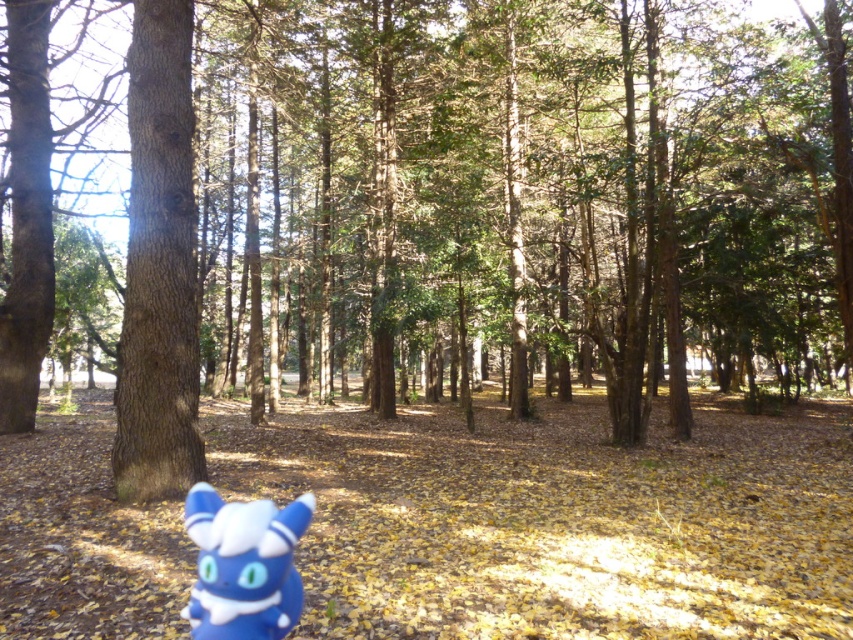
Question: Does smooth brown tree trunk at center appear on the right side of blue plush toy at lower left?

Choices:
 (A) no
 (B) yes

Answer: (A)

Question: Which object appears farthest from the camera in this image?

Choices:
 (A) smooth brown tree trunk at center
 (B) blue plush toy at lower left

Answer: (A)

Question: Can you confirm if smooth brown tree trunk at center is positioned to the right of blue plush toy at lower left?

Choices:
 (A) no
 (B) yes

Answer: (A)

Question: Which point is farther to the camera?

Choices:
 (A) smooth brown tree trunk at center
 (B) blue plush toy at lower left

Answer: (A)

Question: Does smooth brown tree trunk at center appear on the right side of blue plush toy at lower left?

Choices:
 (A) yes
 (B) no

Answer: (B)